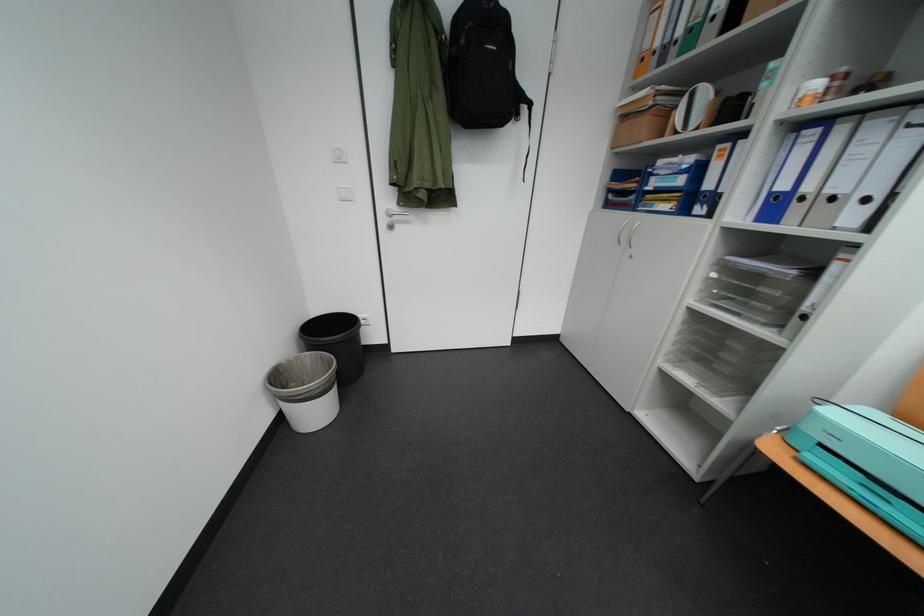
This screenshot has height=616, width=924. I want to click on silver door handle, so click(x=393, y=217).